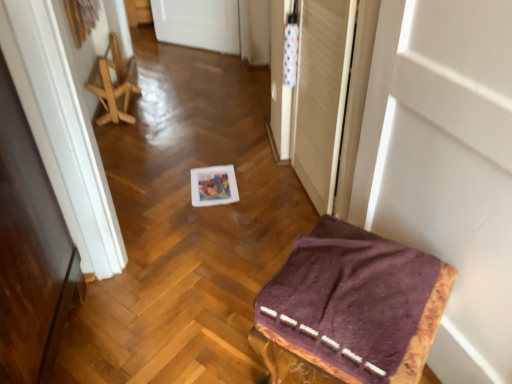
In order to click on free space below transparent plastic screen door at upper right (from a real-world perspective) in this screenshot , I will do `click(301, 195)`.